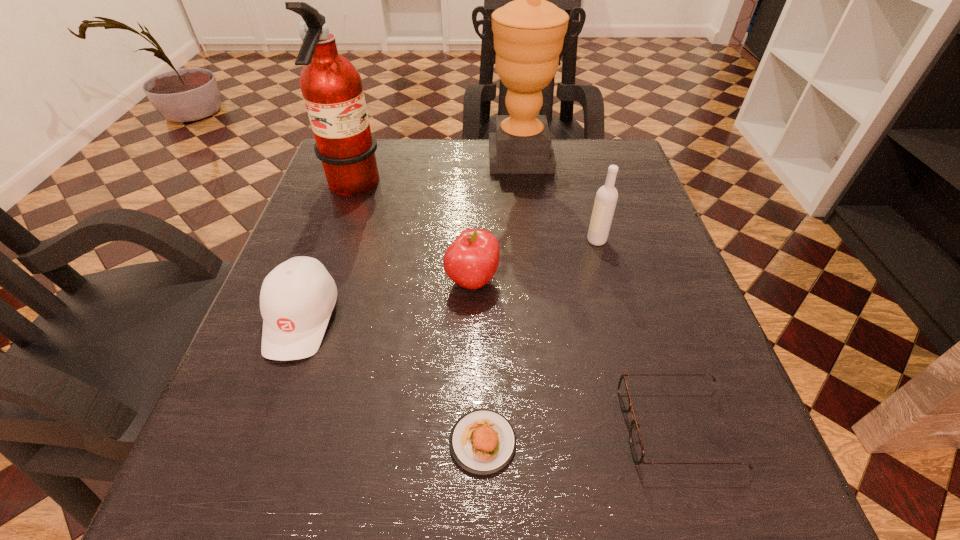
At what (x,y) coordinates should I click in order to perform the action: click on award. Please return your answer as a coordinate pair (x, y). Image resolution: width=960 pixels, height=540 pixels. Looking at the image, I should click on click(x=529, y=32).

What are the coordinates of `fire extinguisher` in the screenshot? It's located at coord(331,86).

Image resolution: width=960 pixels, height=540 pixels. I want to click on vodka, so click(x=606, y=197).

Where is `the fifth nearest object`? the fifth nearest object is located at coordinates (606, 197).

Locate an element on the screen. the fourth tallest object is located at coordinates (471, 260).

Locate an element on the screen. The width and height of the screenshot is (960, 540). baseball cap is located at coordinates (297, 297).

Where is `the second shortest object`? The image size is (960, 540). the second shortest object is located at coordinates (636, 445).

Locate an element on the screen. This screenshot has width=960, height=540. the shortest object is located at coordinates (482, 441).

You are a GUI agent. You are given a task and a screenshot of the screen. Output one action in this format:
    pyautogui.click(x=<x>, y=<y>)
    Task: Click on the vacant area located 0.370m at the front of the award with handles
    
    Given the screenshot: What is the action you would take?
    pyautogui.click(x=534, y=289)

Locate an element on the screen. The height and width of the screenshot is (540, 960). free space located on the nozzle and handle of the fire extinguisher is located at coordinates (456, 188).